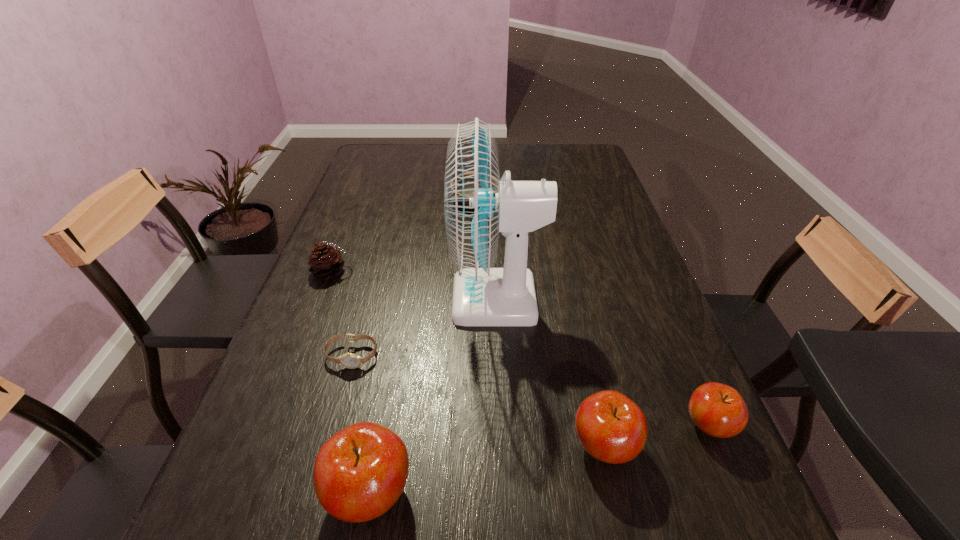
In the image, there is a desktop. Where is `vacant area at the far edge`? This screenshot has height=540, width=960. vacant area at the far edge is located at coordinates (503, 170).

I want to click on vacant space at the left edge of the desktop, so click(x=394, y=191).

At what (x,y) coordinates should I click in order to perform the action: click on blank area at the right edge. Please return your answer as a coordinate pair (x, y). Looking at the image, I should click on (596, 187).

I want to click on vacant space at the far left corner, so click(387, 156).

Where is `blank space at the far right corner of the desktop`? Image resolution: width=960 pixels, height=540 pixels. blank space at the far right corner of the desktop is located at coordinates (580, 164).

At what (x,y) coordinates should I click in order to perform the action: click on free space between the fan and the tallest apple. Please return your answer as a coordinate pair (x, y). Looking at the image, I should click on (434, 396).

Locate an element on the screen. free space that is in between the rightmost object and the pinecone is located at coordinates (520, 349).

This screenshot has height=540, width=960. In order to click on free space that is in between the fourth object from left to right and the leftmost apple in this screenshot , I will do `click(434, 396)`.

The image size is (960, 540). What are the coordinates of `vacant region between the leftmost object and the rightmost apple` in the screenshot? It's located at (520, 349).

This screenshot has width=960, height=540. What are the coordinates of `empty location between the third tallest object and the pinecone` in the screenshot? It's located at (468, 359).